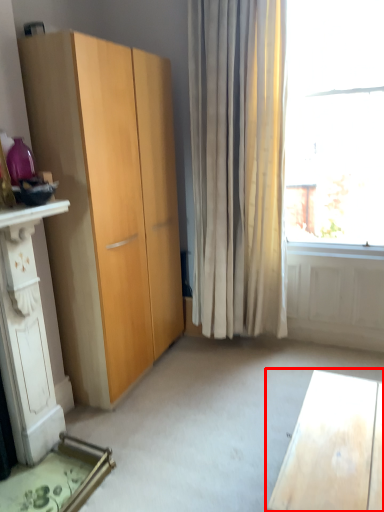
Question: From the image's perspective, considering the relative positions of desk (annotated by the red box) and dresser in the image provided, where is desk (annotated by the red box) located with respect to the staircase?

Choices:
 (A) above
 (B) below

Answer: (B)